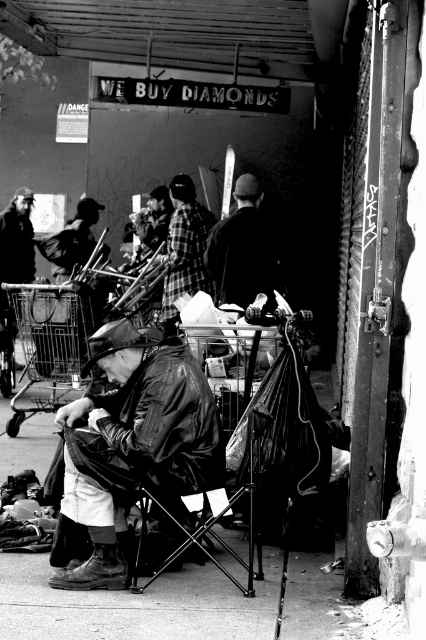
Is leather-like folding chair at center wider than plaid fabric shirt at center?

Yes, leather-like folding chair at center is wider than plaid fabric shirt at center.

Between leather-like folding chair at center and plaid fabric shirt at center, which one is positioned lower?

leather-like folding chair at center is below.

Is point (193, 528) in front of point (204, 243)?

That is True.

In order to click on leather-like folding chair at center in this screenshot , I will do `click(204, 525)`.

Who is positioned more to the left, leather-like folding chair at center or dark fabric jacket at center?

Positioned to the left is leather-like folding chair at center.

Who is taller, leather-like folding chair at center or dark fabric jacket at center?

dark fabric jacket at center

Which is behind, point (222, 392) or point (242, 248)?

The point (242, 248) is more distant.

You are a GUI agent. You are given a task and a screenshot of the screen. Output one action in this format:
    pyautogui.click(x=<x>, y=<y>)
    Task: Click on the leather-like folding chair at center
    
    Given the screenshot: What is the action you would take?
    pyautogui.click(x=204, y=525)

Who is shorter, leather jacket at center or plaid fabric shirt at center?

leather jacket at center

Is leather jacket at center thinner than plaid fabric shirt at center?

No.

Between point (187, 422) and point (175, 173), which one is positioned behind?

The point (175, 173) is behind.

Find the location of a particular element. This screenshot has height=640, width=426. leather jacket at center is located at coordinates (134, 442).